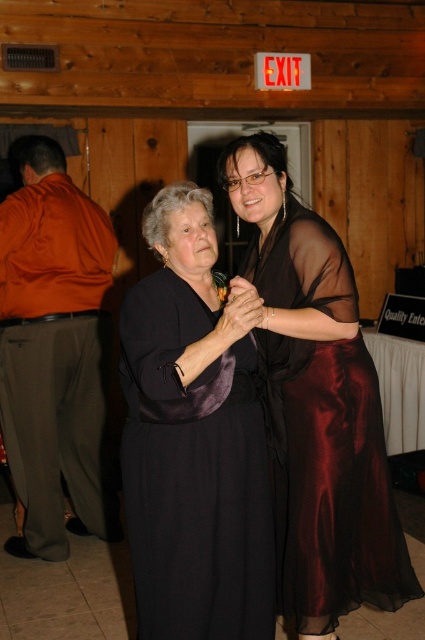
Between point (198, 545) and point (353, 572), which one is positioned in front?

Point (198, 545) is more forward.

Is point (221, 589) farther from viewer compared to point (289, 353)?

No, it is not.

Find the location of a particular element. The image size is (425, 640). satin black dress at center is located at coordinates (193, 438).

Is satin black dress at center shorter than orange satin robe at left?

Yes, satin black dress at center is shorter than orange satin robe at left.

Who is higher up, satin black dress at center or orange satin robe at left?

orange satin robe at left is higher up.

I want to click on satin black dress at center, so click(193, 438).

Who is shorter, sheer dark brown dress at center or orange satin robe at left?

With less height is sheer dark brown dress at center.

Between point (351, 424) and point (84, 307), which one is positioned in front?

Positioned in front is point (351, 424).

Locate an element on the screen. sheer dark brown dress at center is located at coordinates (317, 403).